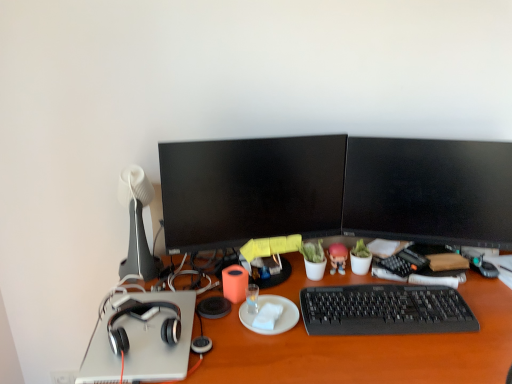
Question: Should I look upward or downward to see white matte lamp at left?

Choices:
 (A) down
 (B) up

Answer: (A)

Question: Is black matte headphones at left shorter than orange matte cup at center?

Choices:
 (A) no
 (B) yes

Answer: (B)

Question: From a real-world perspective, is black matte headphones at left positioned over orange matte cup at center based on gravity?

Choices:
 (A) no
 (B) yes

Answer: (B)

Question: Is black matte headphones at left positioned far away from orange matte cup at center?

Choices:
 (A) yes
 (B) no

Answer: (B)

Question: Can you confirm if black matte headphones at left is wider than orange matte cup at center?

Choices:
 (A) yes
 (B) no

Answer: (A)

Question: Is black matte headphones at left turned away from orange matte cup at center?

Choices:
 (A) yes
 (B) no

Answer: (B)

Question: Does black matte headphones at left have a larger size compared to orange matte cup at center?

Choices:
 (A) yes
 (B) no

Answer: (A)

Question: Is white matte lamp at left thinner than white matte plate at center?

Choices:
 (A) yes
 (B) no

Answer: (A)

Question: Considering the relative sizes of white matte lamp at left and white matte plate at center in the image provided, is white matte lamp at left smaller than white matte plate at center?

Choices:
 (A) no
 (B) yes

Answer: (A)

Question: Is the depth of white matte lamp at left greater than that of white matte plate at center?

Choices:
 (A) yes
 (B) no

Answer: (A)

Question: From the image's perspective, does white matte lamp at left appear higher than white matte plate at center?

Choices:
 (A) yes
 (B) no

Answer: (A)

Question: Does white matte lamp at left turn towards white matte plate at center?

Choices:
 (A) no
 (B) yes

Answer: (A)

Question: Is the position of white matte lamp at left less distant than that of white matte plate at center?

Choices:
 (A) yes
 (B) no

Answer: (B)

Question: Does orange matte cup at center have a smaller size compared to black glossy monitor at center, which is counted as the 1th television, starting from the left?

Choices:
 (A) no
 (B) yes

Answer: (B)